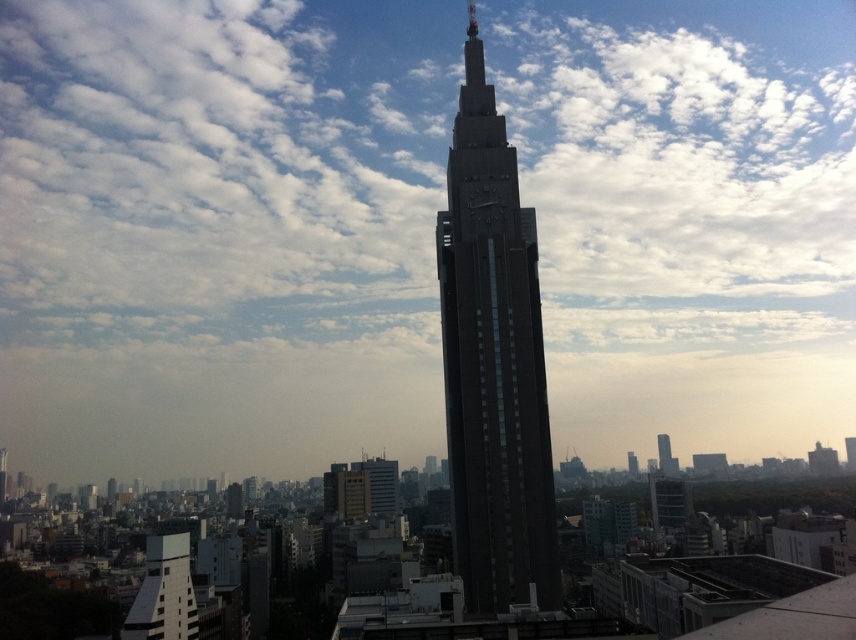
Which is more to the left, dark brown glass tower at center or white textured building at lower left?

white textured building at lower left

Can you confirm if dark brown glass tower at center is taller than white textured building at lower left?

Indeed, dark brown glass tower at center has a greater height compared to white textured building at lower left.

Image resolution: width=856 pixels, height=640 pixels. In order to click on dark brown glass tower at center in this screenshot , I will do `click(492, 362)`.